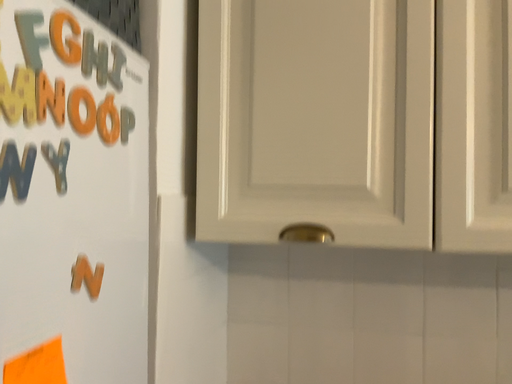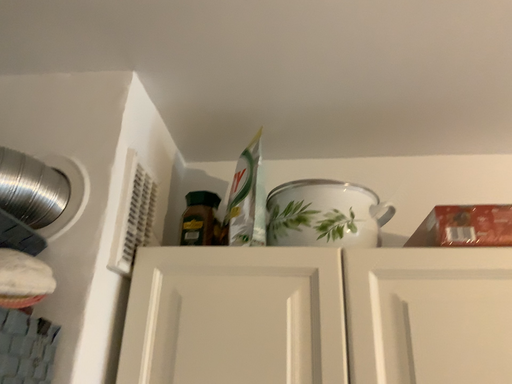
Question: Which way did the camera rotate in the video?

Choices:
 (A) rotated downward
 (B) rotated upward

Answer: (B)